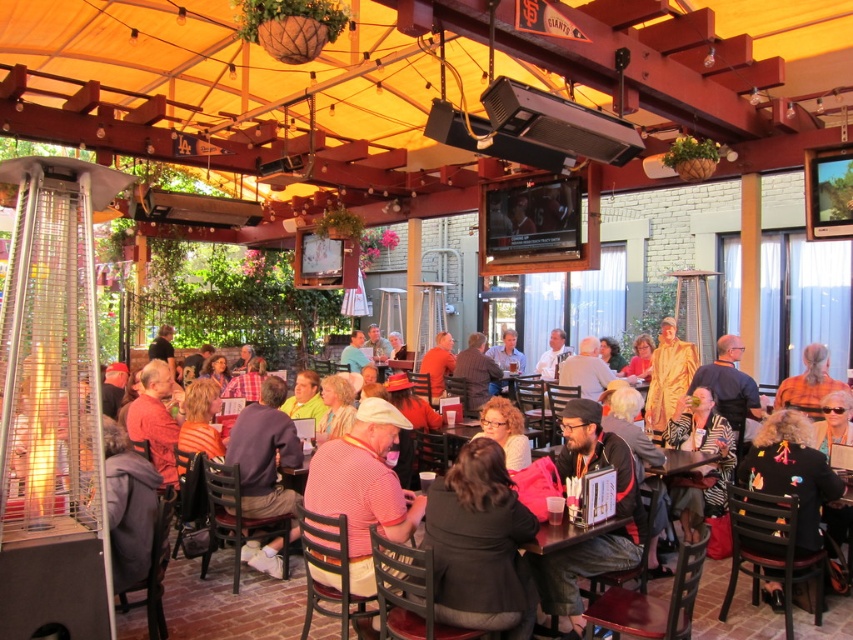
You are a photographer taking a picture of the dark gray knit cap at center and the orange shirt at center. Which object should you focus on first if you want to capture both in the same frame without moving the camera?

The dark gray knit cap at center is below the orange shirt at center, so you should focus on the orange shirt at center first to ensure both are in the frame.

You are a photographer standing in the outdoor dining area and want to take a photo of the dark gray knit cap at center and the orange shirt at center. Which object should you focus on first if you want to capture both in the frame without moving the camera?

The dark gray knit cap at center is positioned on the left side of orange shirt at center, so you should focus on the dark gray knit cap at center first to ensure both are in the frame without moving the camera.

You are a photographer trying to capture a candid shot of the dark gray knit cap at center and the orange shirt at center. The camera lens has a maximum width capacity of 1.2 meters. Can both objects fit within the frame if they are positioned side by side?

The dark gray knit cap at center might be wider than orange shirt at center, so their combined width could exceed the camera lens capacity of 1.2 meters. It is uncertain if they can both fit within the frame.